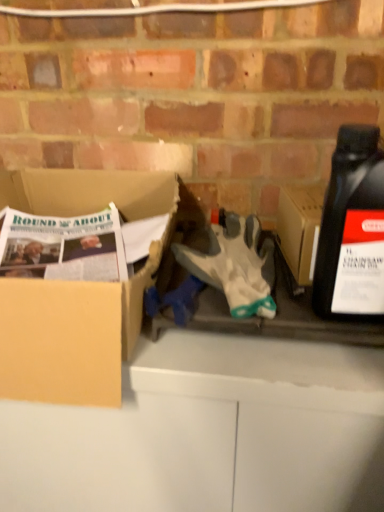
Question: Does cardboard box at left have a smaller size compared to black plastic bottle at right?

Choices:
 (A) yes
 (B) no

Answer: (B)

Question: Is cardboard box at left at the right side of black plastic bottle at right?

Choices:
 (A) yes
 (B) no

Answer: (B)

Question: From the image's perspective, is cardboard box at left below black plastic bottle at right?

Choices:
 (A) no
 (B) yes

Answer: (B)

Question: Is black plastic bottle at right a part of cardboard box at left?

Choices:
 (A) no
 (B) yes

Answer: (A)

Question: Is cardboard box at left aimed at black plastic bottle at right?

Choices:
 (A) no
 (B) yes

Answer: (A)

Question: From the image's perspective, does cardboard box at left appear higher than black plastic bottle at right?

Choices:
 (A) yes
 (B) no

Answer: (B)

Question: Considering the relative sizes of black plastic bottle at right and cardboard box at left in the image provided, is black plastic bottle at right thinner than cardboard box at left?

Choices:
 (A) yes
 (B) no

Answer: (A)

Question: Is black plastic bottle at right wider than cardboard box at left?

Choices:
 (A) no
 (B) yes

Answer: (A)

Question: Can we say black plastic bottle at right lies outside cardboard box at left?

Choices:
 (A) no
 (B) yes

Answer: (B)

Question: From the image's perspective, is black plastic bottle at right on cardboard box at left?

Choices:
 (A) no
 (B) yes

Answer: (B)

Question: Considering the relative positions of black plastic bottle at right and cardboard box at left in the image provided, is black plastic bottle at right to the left of cardboard box at left from the viewer's perspective?

Choices:
 (A) no
 (B) yes

Answer: (A)

Question: From a real-world perspective, does black plastic bottle at right sit lower than cardboard box at left?

Choices:
 (A) yes
 (B) no

Answer: (B)

Question: Considering the relative sizes of black plastic bottle at right and white fabric glove at center in the image provided, is black plastic bottle at right wider than white fabric glove at center?

Choices:
 (A) no
 (B) yes

Answer: (A)